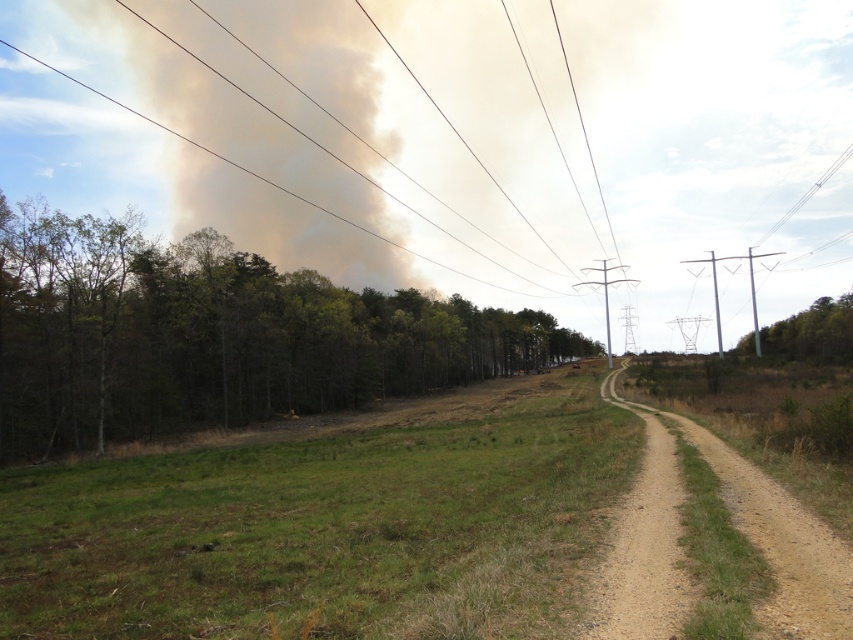
Is green leafy tree at right positioned at the back of dark gray smoke at upper left?

No, green leafy tree at right is in front of dark gray smoke at upper left.

Is green leafy tree at right wider than dark gray smoke at upper left?

In fact, green leafy tree at right might be narrower than dark gray smoke at upper left.

Where is `green leafy tree at right`? The image size is (853, 640). green leafy tree at right is located at coordinates (813, 332).

How distant is green leafy trees at left from green leafy tree at right?

A distance of 62.74 meters exists between green leafy trees at left and green leafy tree at right.

Does green leafy trees at left come in front of green leafy tree at right?

Yes, it is in front of green leafy tree at right.

What are the coordinates of `green leafy trees at left` in the screenshot? It's located at click(x=213, y=337).

This screenshot has width=853, height=640. I want to click on green leafy trees at left, so click(x=213, y=337).

Is point (753, 611) in front of point (71, 77)?

Yes, point (753, 611) is in front of point (71, 77).

You are a GUI agent. You are given a task and a screenshot of the screen. Output one action in this format:
    pyautogui.click(x=<x>, y=<y>)
    Task: Click on the dirt/gravel trail at center
    The image size is (853, 640).
    Given the screenshot: What is the action you would take?
    click(735, 525)